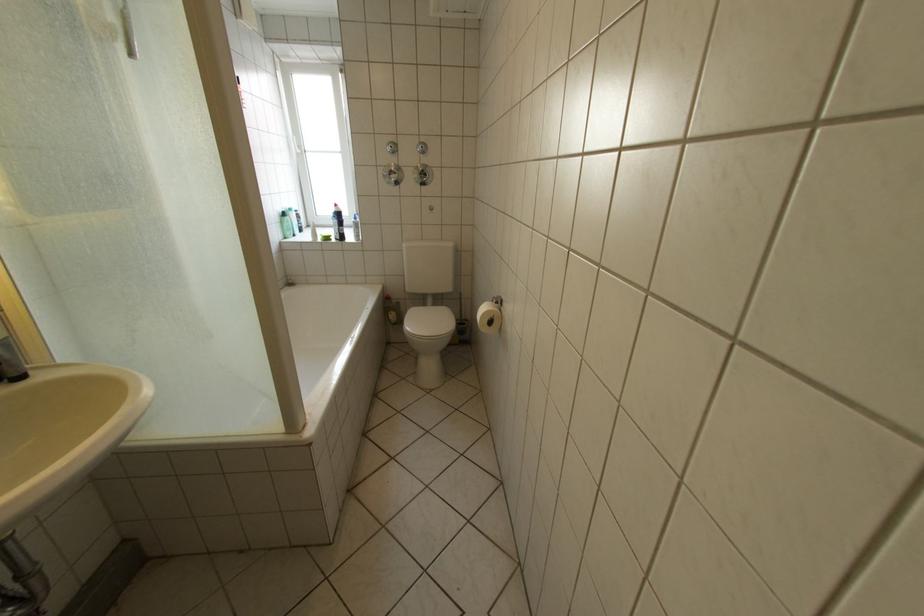
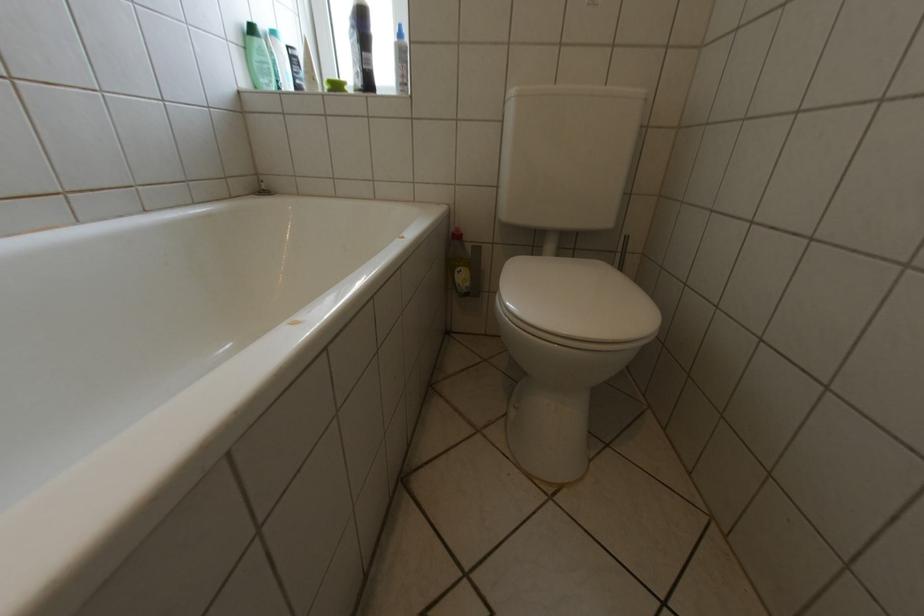
Question: What movement of the cameraman would produce the second image?

Choices:
 (A) Left
 (B) Right
 (C) Forward
 (D) Backward

Answer: (C)